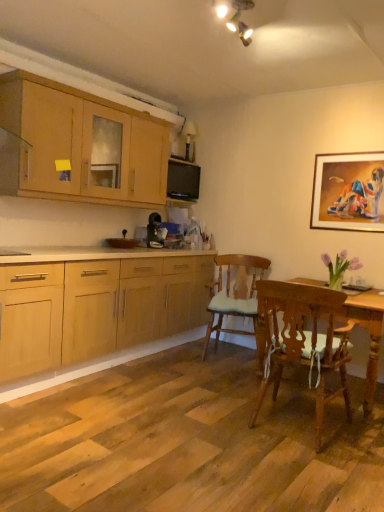
Describe the element at coordinates (183, 180) in the screenshot. I see `black glossy microwave oven at upper center` at that location.

The width and height of the screenshot is (384, 512). What do you see at coordinates (302, 340) in the screenshot? I see `wooden chair with white cushion at lower right, placed as the first chair when sorted from front to back` at bounding box center [302, 340].

What is the approximate width of light wood cabinet at upper left?

12.67 inches.

This screenshot has width=384, height=512. What do you see at coordinates (236, 301) in the screenshot? I see `wooden chair with cushion at center, positioned as the 2th chair in front-to-back order` at bounding box center [236, 301].

You are a GUI agent. You are given a task and a screenshot of the screen. Output one action in this format:
    pyautogui.click(x=<x>, y=<y>)
    Task: Click on the black glossy microwave oven at upper center
    
    Given the screenshot: What is the action you would take?
    pyautogui.click(x=183, y=180)

The height and width of the screenshot is (512, 384). What are the coordinates of `picture frame above the wooden chair with white cushion at lower right, marked as the second chair in a back-to-front arrangement (from the image's perspective)` in the screenshot? It's located at (348, 192).

Does gold-framed painting at upper right have a lesser width compared to wooden chair with white cushion at lower right, marked as the second chair in a back-to-front arrangement?

Correct, the width of gold-framed painting at upper right is less than that of wooden chair with white cushion at lower right, marked as the second chair in a back-to-front arrangement.

Which object is further away from the camera, gold-framed painting at upper right or wooden chair with white cushion at lower right, placed as the first chair when sorted from front to back?

gold-framed painting at upper right is behind.

How different are the orientations of gold-framed painting at upper right and wooden chair with white cushion at lower right, placed as the first chair when sorted from front to back, in degrees?

gold-framed painting at upper right and wooden chair with white cushion at lower right, placed as the first chair when sorted from front to back, are facing 177 degrees away from each other.

Is light wood cabinet at upper left looking in the opposite direction of wooden chair with white cushion at lower right, placed as the first chair when sorted from front to back?

No, light wood cabinet at upper left's orientation is not away from wooden chair with white cushion at lower right, placed as the first chair when sorted from front to back.

Is wooden chair with white cushion at lower right, placed as the first chair when sorted from front to back, located within light wood cabinet at upper left?

Definitely not — wooden chair with white cushion at lower right, placed as the first chair when sorted from front to back, is not inside light wood cabinet at upper left.

Considering the points (119, 141) and (282, 315), which point is behind, point (119, 141) or point (282, 315)?

The point (119, 141) is farther from the camera.

I want to click on chair that is the 2nd object located below the light wood cabinet at upper left (from the image's perspective), so click(302, 340).

Can we say black glossy microwave oven at upper center lies outside light wood cabinet at upper left?

Indeed, black glossy microwave oven at upper center is completely outside light wood cabinet at upper left.

From the image's perspective, relative to light wood cabinet at upper left, is black glossy microwave oven at upper center above or below?

From the image's perspective, black glossy microwave oven at upper center appears below light wood cabinet at upper left.

Are black glossy microwave oven at upper center and light wood cabinet at upper left beside each other?

No, black glossy microwave oven at upper center is not making contact with light wood cabinet at upper left.

Is the depth of black glossy microwave oven at upper center greater than that of light wood cabinet at upper left?

Yes, black glossy microwave oven at upper center is further from the camera.

From the image's perspective, which one is positioned lower, wooden chair with cushion at center, the 1th chair when ordered from back to front, or black glossy microwave oven at upper center?

From the image's view, wooden chair with cushion at center, the 1th chair when ordered from back to front, is below.

Does wooden chair with cushion at center, the 1th chair when ordered from back to front, have a greater width compared to black glossy microwave oven at upper center?

Correct, the width of wooden chair with cushion at center, the 1th chair when ordered from back to front, exceeds that of black glossy microwave oven at upper center.

Which is closer to the camera, [228,289] or [183,186]?

Point [228,289] is positioned closer to the camera compared to point [183,186].

Is point (209, 321) closer or farther from the camera than point (319, 211)?

Point (209, 321) appears to be farther away from the viewer than point (319, 211).

Is wooden chair with cushion at center, the 1th chair when ordered from back to front, bigger or smaller than gold-framed painting at upper right?

wooden chair with cushion at center, the 1th chair when ordered from back to front, is bigger than gold-framed painting at upper right.

Is wooden chair with cushion at center, positioned as the 2th chair in front-to-back order, positioned far away from gold-framed painting at upper right?

No, wooden chair with cushion at center, positioned as the 2th chair in front-to-back order, is in close proximity to gold-framed painting at upper right.

In terms of size, does wooden chair with cushion at center, positioned as the 2th chair in front-to-back order, appear bigger or smaller than wooden chair with white cushion at lower right, marked as the second chair in a back-to-front arrangement?

Clearly, wooden chair with cushion at center, positioned as the 2th chair in front-to-back order, is larger in size than wooden chair with white cushion at lower right, marked as the second chair in a back-to-front arrangement.

Is wooden chair with cushion at center, the 1th chair when ordered from back to front, completely or partially outside of wooden chair with white cushion at lower right, placed as the first chair when sorted from front to back?

Absolutely, wooden chair with cushion at center, the 1th chair when ordered from back to front, is external to wooden chair with white cushion at lower right, placed as the first chair when sorted from front to back.

The width and height of the screenshot is (384, 512). Identify the location of chair above the wooden chair with white cushion at lower right, marked as the second chair in a back-to-front arrangement (from a real-world perspective). (236, 301).

Which point is more forward, (x=173, y=163) or (x=331, y=226)?

The point (x=331, y=226) is closer.

Is black glossy microwave oven at upper center further to camera compared to gold-framed painting at upper right?

Yes.

Where is `picture frame that appears on the right of black glossy microwave oven at upper center`? The height and width of the screenshot is (512, 384). picture frame that appears on the right of black glossy microwave oven at upper center is located at coordinates (348, 192).

Could you tell me if black glossy microwave oven at upper center is facing gold-framed painting at upper right?

No, black glossy microwave oven at upper center is not facing towards gold-framed painting at upper right.

You are a GUI agent. You are given a task and a screenshot of the screen. Output one action in this format:
    pyautogui.click(x=<x>, y=<y>)
    Task: Click on the picture frame behind the wooden chair with white cushion at lower right, placed as the first chair when sorted from front to back
    This screenshot has width=384, height=512.
    Given the screenshot: What is the action you would take?
    pos(348,192)

At what (x,y) coordinates should I click in order to perform the action: click on cabinetry lying above the wooden chair with white cushion at lower right, placed as the first chair when sorted from front to back (from the image's perspective). Please return your answer as a coordinate pair (x, y). Looking at the image, I should click on (83, 144).

Looking at the image, which one is located closer to wooden chair with white cushion at lower right, marked as the second chair in a back-to-front arrangement, wooden chair with cushion at center, positioned as the 2th chair in front-to-back order, or gold-framed painting at upper right?

wooden chair with cushion at center, positioned as the 2th chair in front-to-back order.

Looking at the image, which one is located further to gold-framed painting at upper right, wooden chair with white cushion at lower right, marked as the second chair in a back-to-front arrangement, or black glossy microwave oven at upper center?

black glossy microwave oven at upper center.

Estimate the real-world distances between objects in this image. Which object is closer to black glossy microwave oven at upper center, gold-framed painting at upper right or wooden chair with white cushion at lower right, placed as the first chair when sorted from front to back?

The object closer to black glossy microwave oven at upper center is gold-framed painting at upper right.

Looking at the image, which one is located further to gold-framed painting at upper right, light wood cabinet at upper left or black glossy microwave oven at upper center?

light wood cabinet at upper left is further to gold-framed painting at upper right.

Looking at this image, looking at the image, which one is located closer to wooden chair with white cushion at lower right, placed as the first chair when sorted from front to back, gold-framed painting at upper right or wooden chair with cushion at center, positioned as the 2th chair in front-to-back order?

The object closer to wooden chair with white cushion at lower right, placed as the first chair when sorted from front to back, is wooden chair with cushion at center, positioned as the 2th chair in front-to-back order.

From the image, which object appears to be farther from black glossy microwave oven at upper center, wooden chair with cushion at center, positioned as the 2th chair in front-to-back order, or gold-framed painting at upper right?

gold-framed painting at upper right.

Looking at this image, considering their positions, is light wood cabinet at upper left positioned closer to black glossy microwave oven at upper center than wooden chair with white cushion at lower right, marked as the second chair in a back-to-front arrangement?

Among the two, light wood cabinet at upper left is located nearer to black glossy microwave oven at upper center.

Consider the image. When comparing their distances from black glossy microwave oven at upper center, does gold-framed painting at upper right or light wood cabinet at upper left seem further?

Based on the image, gold-framed painting at upper right appears to be further to black glossy microwave oven at upper center.

The height and width of the screenshot is (512, 384). In order to click on picture frame positioned between wooden chair with white cushion at lower right, marked as the second chair in a back-to-front arrangement, and wooden chair with cushion at center, the 1th chair when ordered from back to front, from near to far in this screenshot , I will do `click(348, 192)`.

Where is `cabinetry between wooden chair with white cushion at lower right, marked as the second chair in a back-to-front arrangement, and black glossy microwave oven at upper center from front to back`? The width and height of the screenshot is (384, 512). cabinetry between wooden chair with white cushion at lower right, marked as the second chair in a back-to-front arrangement, and black glossy microwave oven at upper center from front to back is located at coordinates (83, 144).

I want to click on picture frame between wooden chair with white cushion at lower right, placed as the first chair when sorted from front to back, and black glossy microwave oven at upper center, along the z-axis, so click(x=348, y=192).

I want to click on chair between wooden chair with white cushion at lower right, marked as the second chair in a back-to-front arrangement, and black glossy microwave oven at upper center from front to back, so click(x=236, y=301).